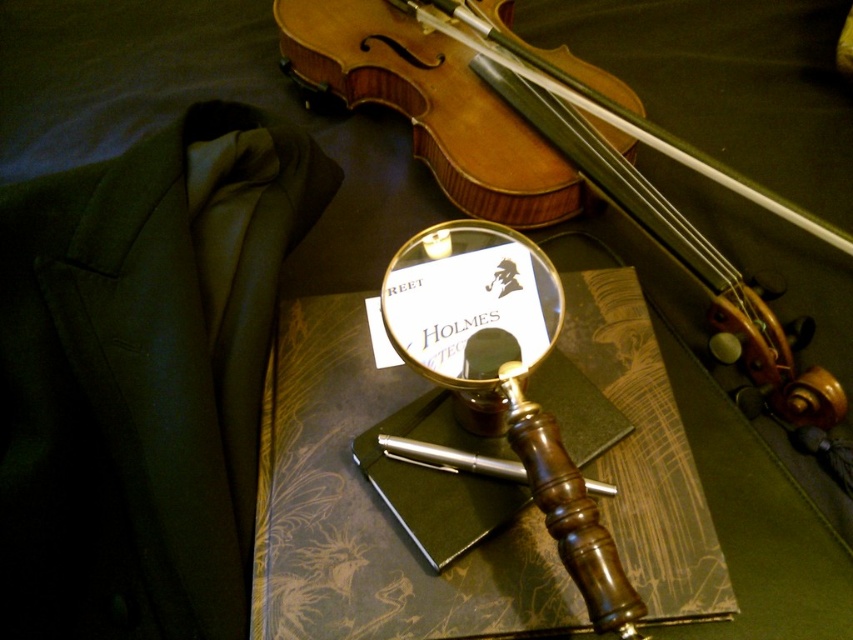
Who is more distant from viewer, (x=339, y=10) or (x=527, y=333)?

The point (x=339, y=10) is behind.

Does wooden violin at upper center have a lesser width compared to gold polished magnifying glass at center?

No, wooden violin at upper center is not thinner than gold polished magnifying glass at center.

Image resolution: width=853 pixels, height=640 pixels. I want to click on wooden violin at upper center, so click(431, 104).

Where is `wooden violin at upper center`? The width and height of the screenshot is (853, 640). wooden violin at upper center is located at coordinates (431, 104).